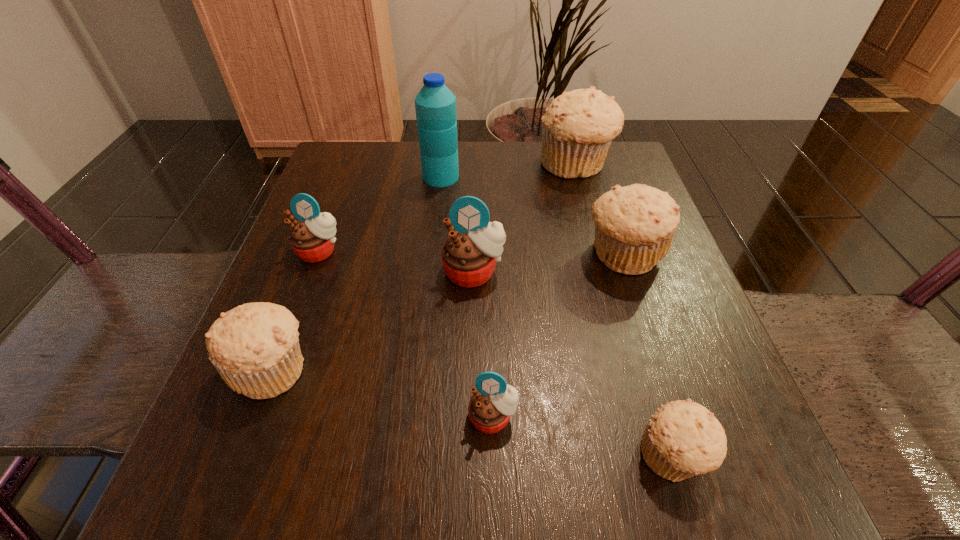
Locate an element on the screen. The width and height of the screenshot is (960, 540). vacant space that satisfies the following two spatial constraints: 1. on the front-facing side of the leftmost pink muffin; 2. on the right side of the second biggest beige muffin is located at coordinates (318, 255).

What are the coordinates of `free location that satisfies the following two spatial constraints: 1. on the front-facing side of the biggest pink muffin; 2. on the left side of the smallest beige muffin` in the screenshot? It's located at (471, 456).